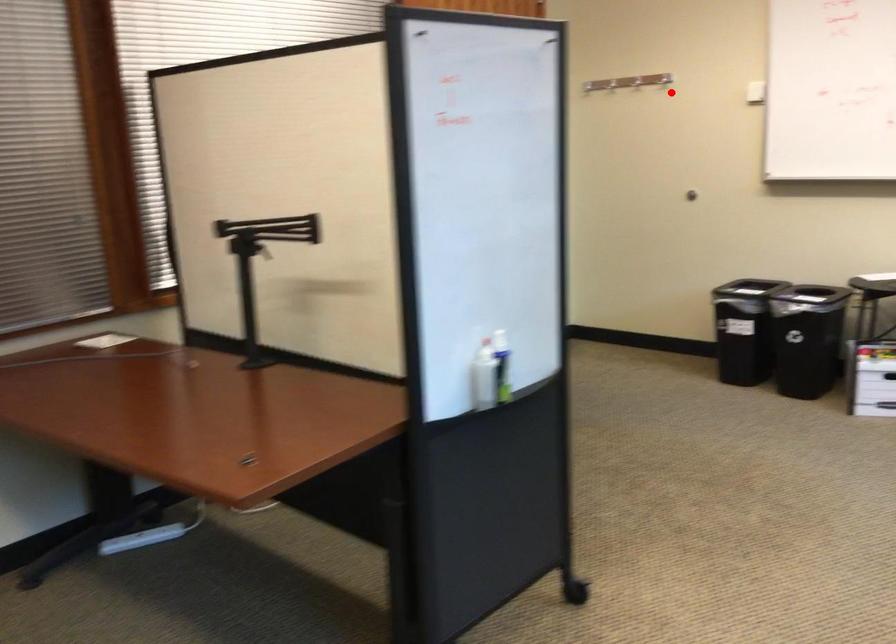
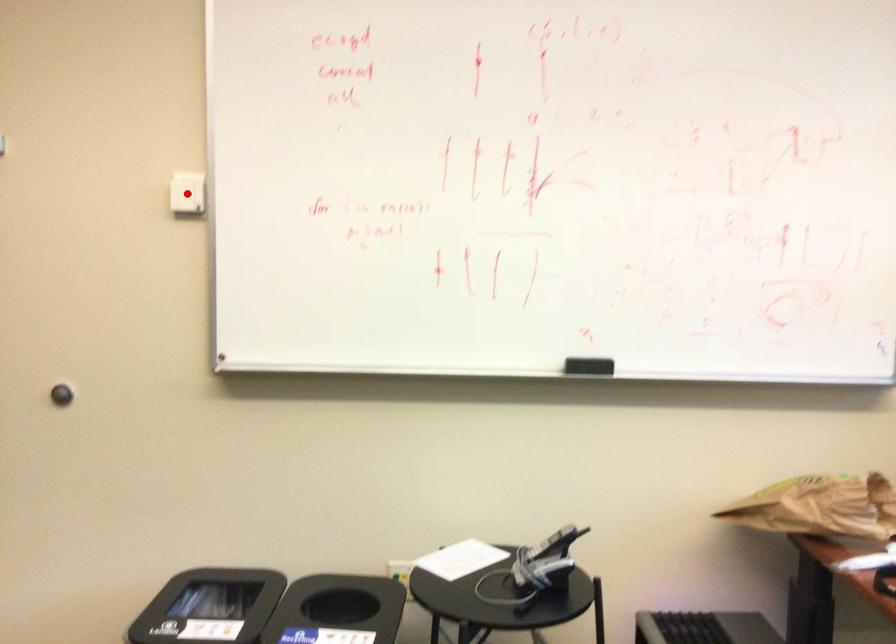
I am providing you with two images of the same scene from different viewpoints. A red point is marked on the first image and another point is marked on the second image. Is the marked point in image1 the same physical position as the marked point in image2?

Yes